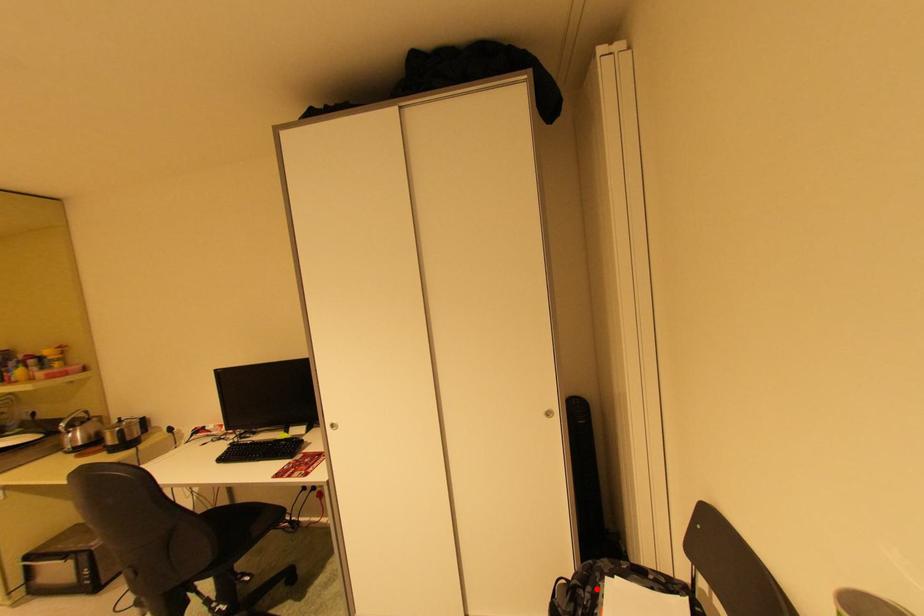
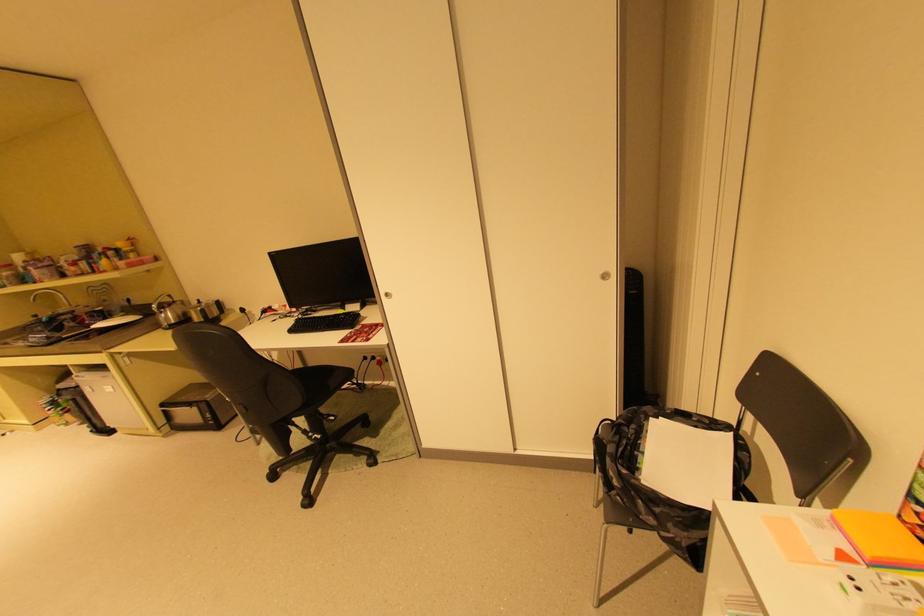
In the second image, find the point that corresponds to the highlighted location in the first image.

(640, 427)